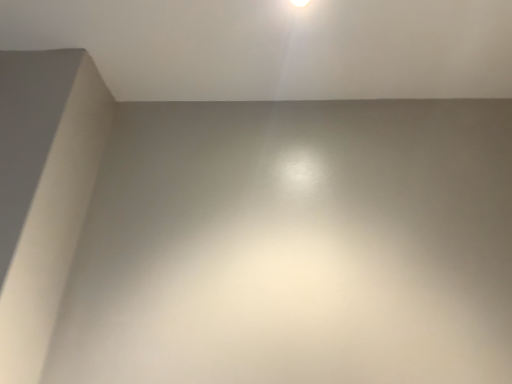
Where is `free point above white matte wall at upper center (from a real-world perspective)`? The height and width of the screenshot is (384, 512). free point above white matte wall at upper center (from a real-world perspective) is located at coordinates (262, 51).